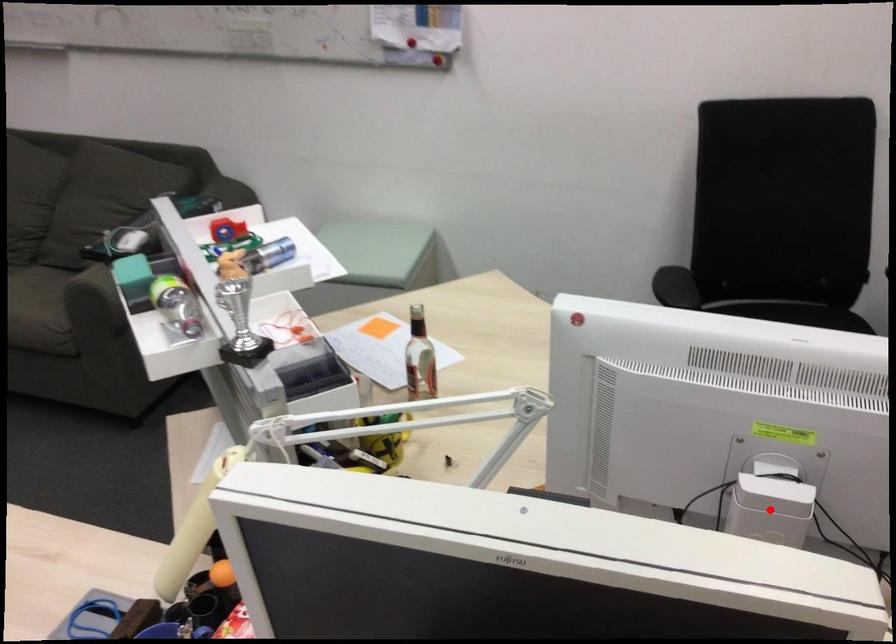
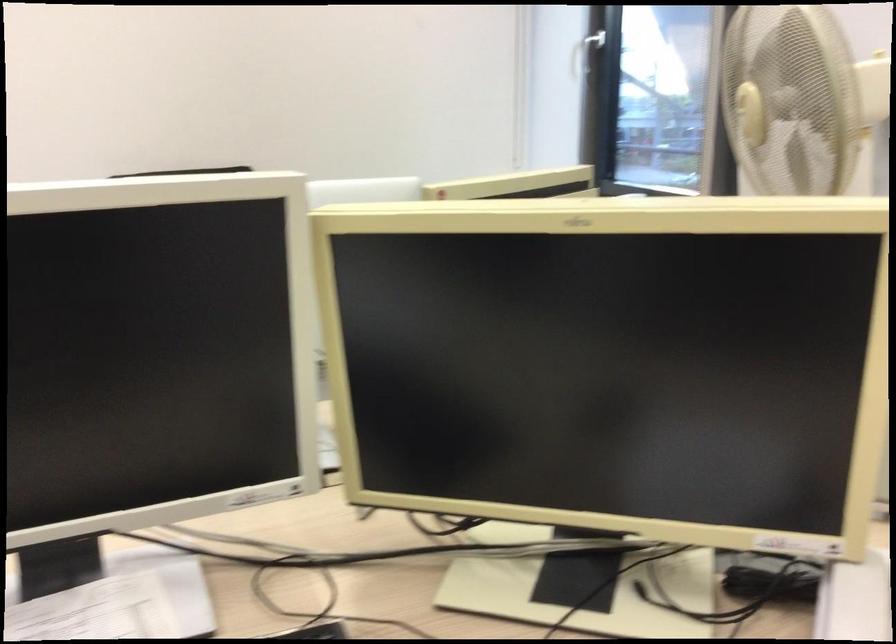
Question: I am providing you with two images of the same scene from different viewpoints. A red point is marked on the first image. At the location where the point appears in image 1, is it still visible in image 2?

Choices:
 (A) Yes
 (B) No

Answer: (B)